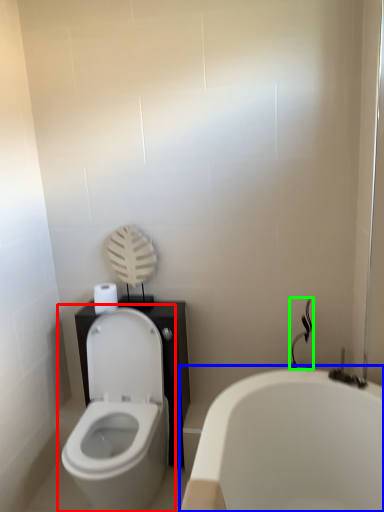
Question: Which object is positioned farthest from toilet (highlighted by a red box)? Select from bathtub (highlighted by a blue box) and shower (highlighted by a green box).

Choices:
 (A) bathtub
 (B) shower

Answer: (B)